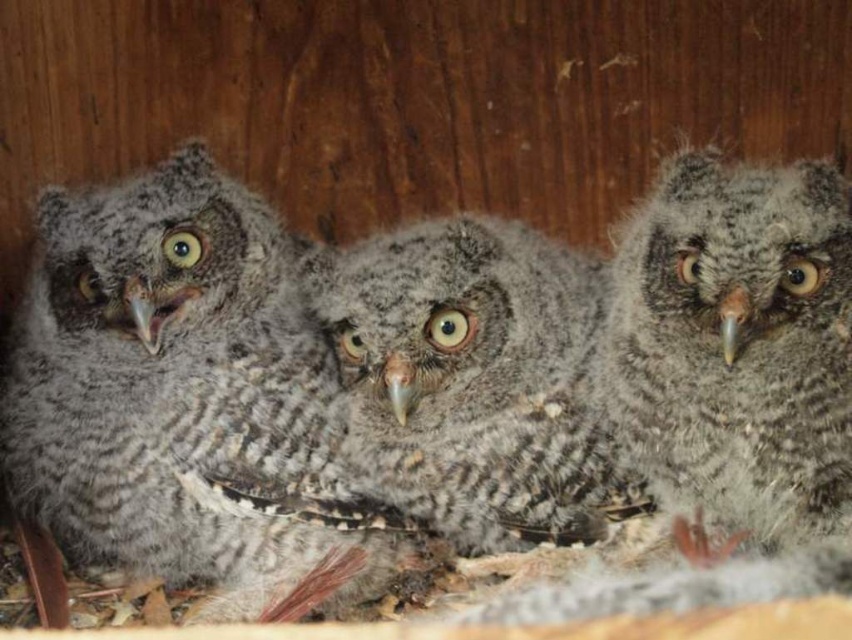
In the scene shown: Who is higher up, gray fluffy owl at left or gray fluffy owl at center?

gray fluffy owl at center is above.

Is gray fluffy owl at left positioned at the back of gray fluffy owl at center?

That is False.

Who is more forward, (18,355) or (563,404)?

Positioned in front is point (563,404).

The image size is (852, 640). I want to click on gray fluffy owl at left, so click(x=182, y=396).

Is point (741, 497) less distant than point (471, 326)?

That is True.

Is gray fluffy owl at right further to the viewer compared to gray fluffy owl at center?

No, gray fluffy owl at right is closer to the viewer.

Between point (724, 292) and point (573, 276), which one is positioned in front?

Point (724, 292) is in front.

Where is `gray fluffy owl at right`? Image resolution: width=852 pixels, height=640 pixels. gray fluffy owl at right is located at coordinates (737, 344).

Describe the element at coordinates (182, 396) in the screenshot. Image resolution: width=852 pixels, height=640 pixels. I see `gray fluffy owl at left` at that location.

Between gray fluffy owl at left and gray fluffy owl at right, which one has less height?

Standing shorter between the two is gray fluffy owl at right.

Between point (78, 385) and point (787, 237), which one is positioned behind?

The point (78, 385) is more distant.

You are a GUI agent. You are given a task and a screenshot of the screen. Output one action in this format:
    pyautogui.click(x=<x>, y=<y>)
    Task: Click on the gray fluffy owl at left
    The height and width of the screenshot is (640, 852).
    Given the screenshot: What is the action you would take?
    pyautogui.click(x=182, y=396)